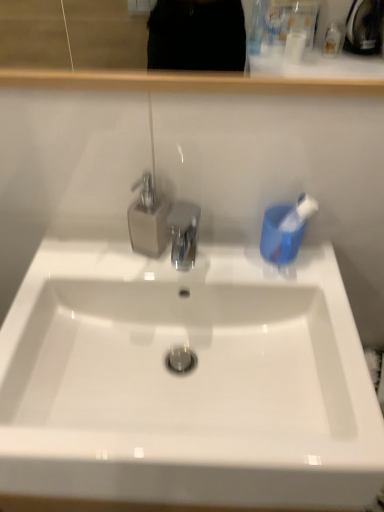
Locate an element on the screen. This screenshot has width=384, height=512. vacant space situated on the left part of blue plastic toothbrush at right is located at coordinates (225, 257).